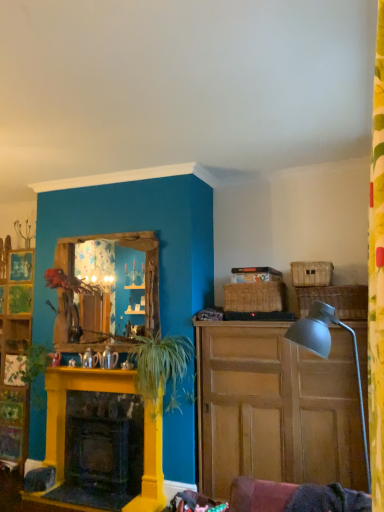
Question: Is green leafy plant at center, positioned as the second plant in left-to-right order, oriented away from wooden mirror at center?

Choices:
 (A) no
 (B) yes

Answer: (A)

Question: Is green leafy plant at center, positioned as the second plant in left-to-right order, beside wooden mirror at center?

Choices:
 (A) no
 (B) yes

Answer: (A)

Question: Is green leafy plant at center, which is the 1th plant in right-to-left order, oriented towards wooden mirror at center?

Choices:
 (A) yes
 (B) no

Answer: (B)

Question: From a real-world perspective, does green leafy plant at center, which is the 1th plant in right-to-left order, stand above wooden mirror at center?

Choices:
 (A) yes
 (B) no

Answer: (B)

Question: Can you confirm if green leafy plant at center, which is the 1th plant in right-to-left order, is smaller than wooden mirror at center?

Choices:
 (A) no
 (B) yes

Answer: (A)

Question: From a real-world perspective, is green leafy plant at center, positioned as the second plant in left-to-right order, under wooden mirror at center?

Choices:
 (A) no
 (B) yes

Answer: (B)

Question: Is the position of green leafy plant at left, the second plant positioned from the right, more distant than that of woven wicker picnic basket at right, the 3th picnic basket viewed from the left?

Choices:
 (A) yes
 (B) no

Answer: (A)

Question: Does green leafy plant at left, the second plant positioned from the right, have a greater height compared to woven wicker picnic basket at right, which is the 1th picnic basket from right to left?

Choices:
 (A) yes
 (B) no

Answer: (A)

Question: Is green leafy plant at left, which ranks as the 1th plant in left-to-right order, positioned before woven wicker picnic basket at right, which is the 1th picnic basket from right to left?

Choices:
 (A) yes
 (B) no

Answer: (B)

Question: Is green leafy plant at left, which ranks as the 1th plant in left-to-right order, smaller than woven wicker picnic basket at right, which is the 1th picnic basket from right to left?

Choices:
 (A) yes
 (B) no

Answer: (B)

Question: Does green leafy plant at left, the second plant positioned from the right, have a greater width compared to woven wicker picnic basket at right, the 3th picnic basket viewed from the left?

Choices:
 (A) yes
 (B) no

Answer: (A)

Question: Is green leafy plant at left, the second plant positioned from the right, to the left of woven wicker picnic basket at right, which is the 1th picnic basket from right to left, from the viewer's perspective?

Choices:
 (A) yes
 (B) no

Answer: (A)

Question: Does wooden mirror at center appear on the left side of green leafy plant at center, which is the 1th plant in right-to-left order?

Choices:
 (A) no
 (B) yes

Answer: (B)